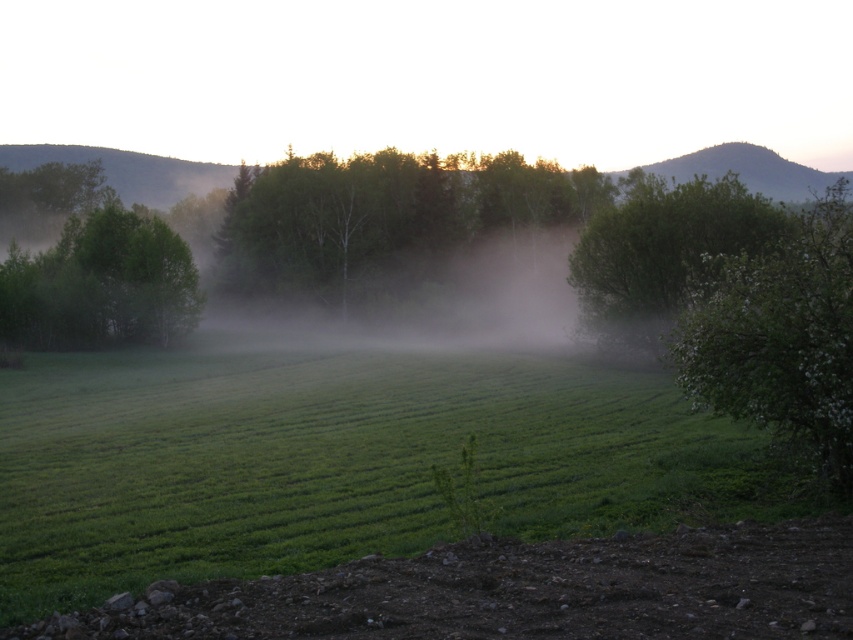
Does green leafy tree at upper right come in front of green matte tree at left?

Yes.

Can you confirm if green leafy tree at upper right is taller than green matte tree at left?

Indeed, green leafy tree at upper right has a greater height compared to green matte tree at left.

Does point (599, 241) come behind point (181, 314)?

That is False.

What are the coordinates of `green leafy tree at upper right` in the screenshot? It's located at (660, 253).

Can you confirm if green grassy field at center is positioned below foggy mist at center?

Yes.

Is the position of green grassy field at center more distant than that of foggy mist at center?

That is False.

Where is `green grassy field at center`? This screenshot has height=640, width=853. green grassy field at center is located at coordinates (329, 460).

Image resolution: width=853 pixels, height=640 pixels. I want to click on green grassy field at center, so click(329, 460).

Is green leafy tree at right shorter than green leafy tree at upper right?

Indeed, green leafy tree at right has a lesser height compared to green leafy tree at upper right.

Who is more distant from viewer, (741, 252) or (740, 252)?

The point (740, 252) is behind.

You are a GUI agent. You are given a task and a screenshot of the screen. Output one action in this format:
    pyautogui.click(x=<x>, y=<y>)
    Task: Click on the green leafy tree at right
    
    Given the screenshot: What is the action you would take?
    pyautogui.click(x=779, y=333)